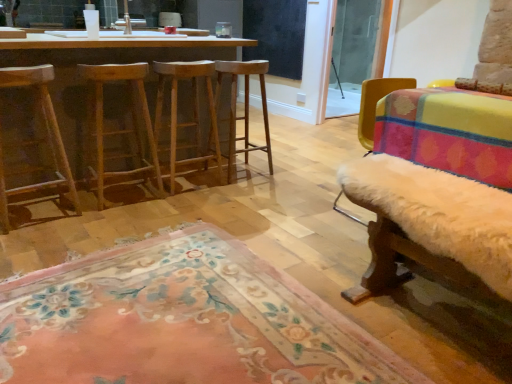
Find the location of `vacant area that lies in front of wooden stool at center, placed as the 3th stool when sorted from left to right`. vacant area that lies in front of wooden stool at center, placed as the 3th stool when sorted from left to right is located at coordinates (240, 190).